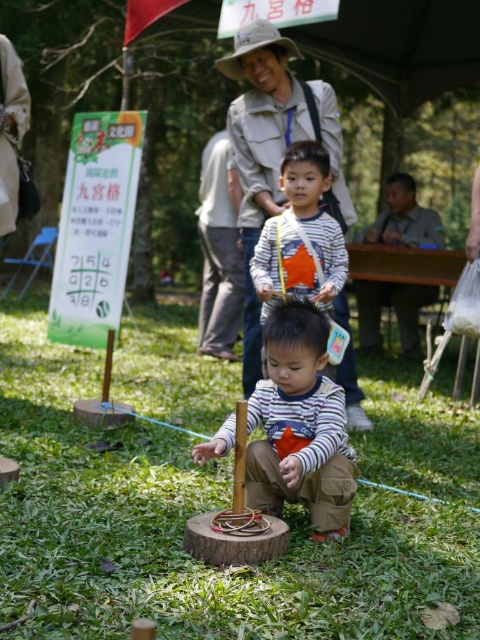
Which is behind, point (269, 234) or point (393, 184)?

Positioned behind is point (393, 184).

Can you confirm if striped cotton shirt at upper center is positioned to the left of brown leather jacket at right?

Yes, striped cotton shirt at upper center is to the left of brown leather jacket at right.

Who is more forward, [319,182] or [402,179]?

Point [319,182]

Locate an element on the screen. striped cotton shirt at upper center is located at coordinates (300, 236).

Does brown leather jacket at upper center lie behind brown leather jacket at right?

No, it is not.

What are the coordinates of `brown leather jacket at upper center` in the screenshot? It's located at (219, 250).

Is point (213, 218) positioned in front of point (384, 212)?

Yes, point (213, 218) is in front of point (384, 212).

At what (x,y) coordinates should I click in order to perform the action: click on brown leather jacket at upper center. Please return your answer as a coordinate pair (x, y). This screenshot has height=640, width=480. Looking at the image, I should click on (219, 250).

Which is above, striped cotton shirt at center or striped cotton shirt at upper center?

striped cotton shirt at upper center

Is striped cotton shirt at center in front of striped cotton shirt at upper center?

Yes, striped cotton shirt at center is in front of striped cotton shirt at upper center.

Between point (288, 320) and point (266, 236), which one is positioned in front?

Point (288, 320) is more forward.

Locate an element on the screen. This screenshot has width=480, height=640. striped cotton shirt at center is located at coordinates (300, 426).